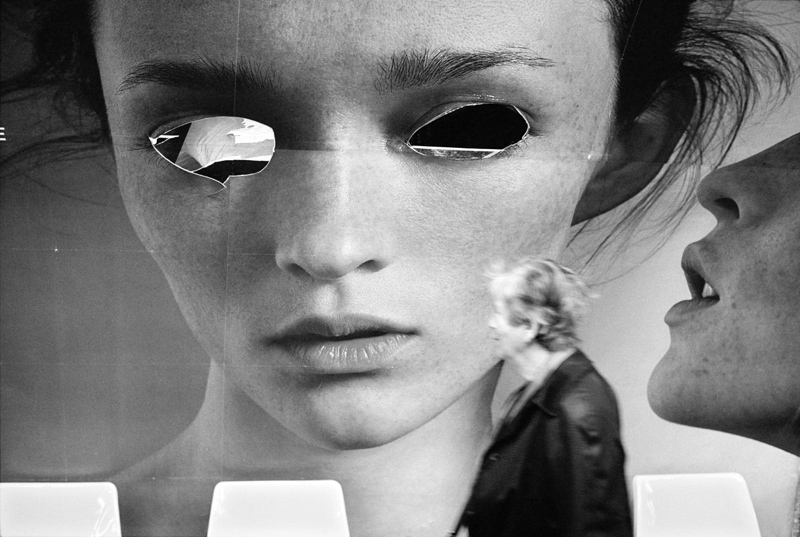
Where is `eye hole`? eye hole is located at coordinates (470, 130), (222, 143).